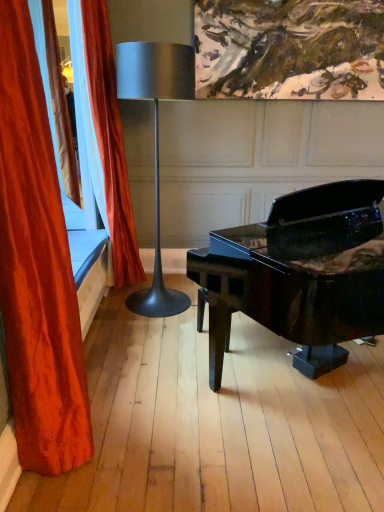
I want to click on metallic silver lamp at center, so click(156, 142).

At what (x,y) coordinates should I click in order to perform the action: click on velvet orange curtain at left, positioned as the 1th curtain in back-to-front order. Please return your answer as a coordinate pair (x, y). The image size is (384, 512). Looking at the image, I should click on (110, 141).

Identify the location of velvet red curtain at left, the 2th curtain viewed from the back. This screenshot has width=384, height=512. (37, 268).

Does velvet red curtain at left, the 1th curtain positioned from the front, contain velvet orange curtain at left, marked as the 2th curtain in a front-to-back arrangement?

No, velvet orange curtain at left, marked as the 2th curtain in a front-to-back arrangement, is located outside of velvet red curtain at left, the 1th curtain positioned from the front.

Is velvet red curtain at left, the 1th curtain positioned from the front, positioned far away from velvet orange curtain at left, marked as the 2th curtain in a front-to-back arrangement?

Yes, velvet red curtain at left, the 1th curtain positioned from the front, is far from velvet orange curtain at left, marked as the 2th curtain in a front-to-back arrangement.

The image size is (384, 512). Identify the location of curtain on the right of velvet red curtain at left, the 2th curtain viewed from the back. (110, 141).

Looking at this image, from the image's perspective, is velvet red curtain at left, the 2th curtain viewed from the back, on velvet orange curtain at left, positioned as the 1th curtain in back-to-front order?

No, from the image's perspective, velvet red curtain at left, the 2th curtain viewed from the back, is not over velvet orange curtain at left, positioned as the 1th curtain in back-to-front order.

Is glossy black piano at center aimed at metallic silver lamp at center?

No, glossy black piano at center is not oriented towards metallic silver lamp at center.

Can you confirm if glossy black piano at center is smaller than metallic silver lamp at center?

Actually, glossy black piano at center might be larger than metallic silver lamp at center.

Find the location of a particular element. Image resolution: width=384 pixels, height=512 pixels. piano to the right of metallic silver lamp at center is located at coordinates (299, 274).

Which point is more forward, (286, 298) or (149, 86)?

The point (149, 86) is in front.

Is glossy black piano at center positioned beyond the bounds of velvet red curtain at left, the 1th curtain positioned from the front?

Absolutely, glossy black piano at center is external to velvet red curtain at left, the 1th curtain positioned from the front.

Is glossy black piano at center not close to velvet red curtain at left, the 2th curtain viewed from the back?

That's right, there is a large distance between glossy black piano at center and velvet red curtain at left, the 2th curtain viewed from the back.

From the image's perspective, which one is positioned higher, glossy black piano at center or velvet red curtain at left, the 2th curtain viewed from the back?

From the image's view, velvet red curtain at left, the 2th curtain viewed from the back, is above.

Considering the sizes of velvet orange curtain at left, positioned as the 1th curtain in back-to-front order, and velvet red curtain at left, the 2th curtain viewed from the back, in the image, is velvet orange curtain at left, positioned as the 1th curtain in back-to-front order, wider or thinner than velvet red curtain at left, the 2th curtain viewed from the back,?

Considering their sizes, velvet orange curtain at left, positioned as the 1th curtain in back-to-front order, looks broader than velvet red curtain at left, the 2th curtain viewed from the back.

Is velvet orange curtain at left, marked as the 2th curtain in a front-to-back arrangement, not inside velvet red curtain at left, the 1th curtain positioned from the front?

Yes, velvet orange curtain at left, marked as the 2th curtain in a front-to-back arrangement, is outside of velvet red curtain at left, the 1th curtain positioned from the front.

Is velvet orange curtain at left, marked as the 2th curtain in a front-to-back arrangement, in contact with velvet red curtain at left, the 1th curtain positioned from the front?

No, velvet orange curtain at left, marked as the 2th curtain in a front-to-back arrangement, is not beside velvet red curtain at left, the 1th curtain positioned from the front.

Does velvet orange curtain at left, positioned as the 1th curtain in back-to-front order, have a smaller size compared to velvet red curtain at left, the 2th curtain viewed from the back?

No.

From the picture: Based on their positions, is metallic silver lamp at center located to the left or right of velvet orange curtain at left, positioned as the 1th curtain in back-to-front order?

Result: Clearly, metallic silver lamp at center is on the right of velvet orange curtain at left, positioned as the 1th curtain in back-to-front order, in the image.

How many degrees apart are the facing directions of metallic silver lamp at center and velvet orange curtain at left, positioned as the 1th curtain in back-to-front order?

90.5 degrees separate the facing orientations of metallic silver lamp at center and velvet orange curtain at left, positioned as the 1th curtain in back-to-front order.

Are metallic silver lamp at center and velvet orange curtain at left, marked as the 2th curtain in a front-to-back arrangement, beside each other?

No, metallic silver lamp at center is not touching velvet orange curtain at left, marked as the 2th curtain in a front-to-back arrangement.

Consider the image. Is metallic silver lamp at center positioned with its back to velvet orange curtain at left, marked as the 2th curtain in a front-to-back arrangement?

No.

Identify the location of lamp on the right of velvet red curtain at left, the 2th curtain viewed from the back. (156, 142).

Measure the distance from metallic silver lamp at center to velvet red curtain at left, the 2th curtain viewed from the back.

metallic silver lamp at center and velvet red curtain at left, the 2th curtain viewed from the back, are 5.20 feet apart from each other.

From the image's perspective, which is below, metallic silver lamp at center or velvet red curtain at left, the 1th curtain positioned from the front?

velvet red curtain at left, the 1th curtain positioned from the front, from the image's perspective.

Between metallic silver lamp at center and velvet red curtain at left, the 2th curtain viewed from the back, which one is positioned in front?

velvet red curtain at left, the 2th curtain viewed from the back, is closer to the camera.

Can you see velvet orange curtain at left, marked as the 2th curtain in a front-to-back arrangement, touching metallic silver lamp at center?

No, velvet orange curtain at left, marked as the 2th curtain in a front-to-back arrangement, is not beside metallic silver lamp at center.

Between velvet orange curtain at left, marked as the 2th curtain in a front-to-back arrangement, and metallic silver lamp at center, which one has larger width?

With larger width is metallic silver lamp at center.

Which object is positioned more to the left, velvet orange curtain at left, positioned as the 1th curtain in back-to-front order, or metallic silver lamp at center?

velvet orange curtain at left, positioned as the 1th curtain in back-to-front order.

Between velvet orange curtain at left, marked as the 2th curtain in a front-to-back arrangement, and metallic silver lamp at center, which one has smaller size?

velvet orange curtain at left, marked as the 2th curtain in a front-to-back arrangement.

Identify the location of curtain that is under the velvet orange curtain at left, positioned as the 1th curtain in back-to-front order (from a real-world perspective). point(37,268).

Find the location of a particular element. lamp located on the left of glossy black piano at center is located at coordinates [x=156, y=142].

From the image, which object appears to be nearer to metallic silver lamp at center, glossy black piano at center or velvet red curtain at left, the 2th curtain viewed from the back?

Based on the image, glossy black piano at center appears to be nearer to metallic silver lamp at center.

Based on their spatial positions, is velvet red curtain at left, the 2th curtain viewed from the back, or metallic silver lamp at center closer to velvet orange curtain at left, marked as the 2th curtain in a front-to-back arrangement?

metallic silver lamp at center is positioned closer to the anchor velvet orange curtain at left, marked as the 2th curtain in a front-to-back arrangement.

From the image, which object appears to be nearer to glossy black piano at center, velvet red curtain at left, the 1th curtain positioned from the front, or metallic silver lamp at center?

metallic silver lamp at center.

When comparing their distances from velvet red curtain at left, the 1th curtain positioned from the front, does glossy black piano at center or velvet orange curtain at left, marked as the 2th curtain in a front-to-back arrangement, seem further?

Among the two, velvet orange curtain at left, marked as the 2th curtain in a front-to-back arrangement, is located further to velvet red curtain at left, the 1th curtain positioned from the front.

Based on their spatial positions, is velvet red curtain at left, the 2th curtain viewed from the back, or velvet orange curtain at left, marked as the 2th curtain in a front-to-back arrangement, closer to glossy black piano at center?

velvet orange curtain at left, marked as the 2th curtain in a front-to-back arrangement, lies closer to glossy black piano at center than the other object.

Estimate the real-world distances between objects in this image. Which object is further from velvet red curtain at left, the 2th curtain viewed from the back, glossy black piano at center or metallic silver lamp at center?

Among the two, metallic silver lamp at center is located further to velvet red curtain at left, the 2th curtain viewed from the back.

Considering their positions, is velvet orange curtain at left, marked as the 2th curtain in a front-to-back arrangement, positioned further to metallic silver lamp at center than velvet red curtain at left, the 2th curtain viewed from the back?

The object further to metallic silver lamp at center is velvet red curtain at left, the 2th curtain viewed from the back.

From the picture: Considering their positions, is velvet orange curtain at left, positioned as the 1th curtain in back-to-front order, positioned further to metallic silver lamp at center than glossy black piano at center?

glossy black piano at center lies further to metallic silver lamp at center than the other object.

Find the location of a particular element. curtain situated between velvet red curtain at left, the 1th curtain positioned from the front, and glossy black piano at center from left to right is located at coordinates (110, 141).

In order to click on lamp between velvet red curtain at left, the 1th curtain positioned from the front, and velvet orange curtain at left, marked as the 2th curtain in a front-to-back arrangement, in the front-back direction in this screenshot , I will do `click(156, 142)`.

You are a GUI agent. You are given a task and a screenshot of the screen. Output one action in this format:
    pyautogui.click(x=<x>, y=<y>)
    Task: Click on the curtain between glossy black piano at center and metallic silver lamp at center in the front-back direction
    This screenshot has height=512, width=384.
    Given the screenshot: What is the action you would take?
    pyautogui.click(x=37, y=268)

At what (x,y) coordinates should I click in order to perform the action: click on lamp between glossy black piano at center and velvet orange curtain at left, marked as the 2th curtain in a front-to-back arrangement, from front to back. Please return your answer as a coordinate pair (x, y). Looking at the image, I should click on [156, 142].